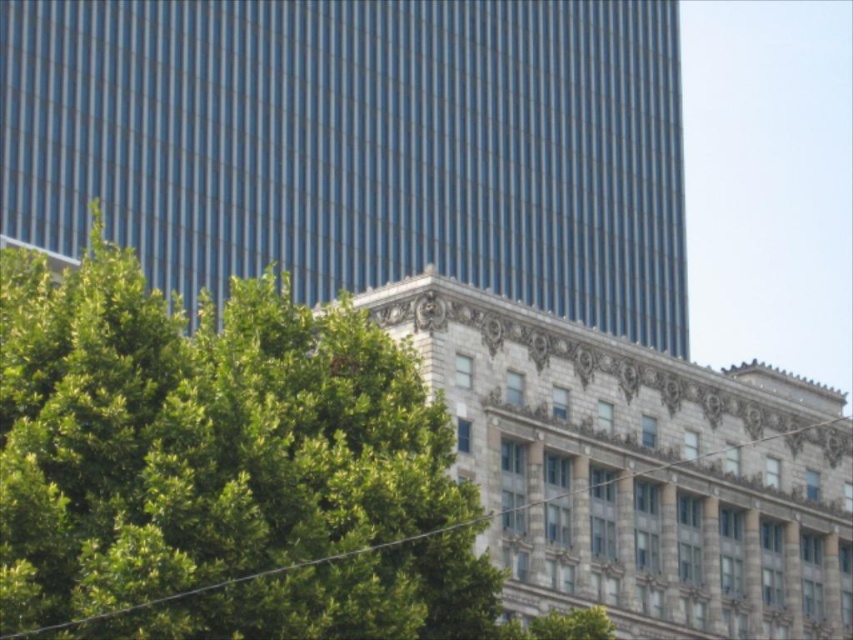
Question: Which of the following is the closest to the observer?

Choices:
 (A) glassy blue skyscraper at upper left
 (B) green leafy tree at lower left

Answer: (B)

Question: Among these objects, which one is nearest to the camera?

Choices:
 (A) green leafy tree at lower left
 (B) glassy blue skyscraper at upper left

Answer: (A)

Question: Can you confirm if glassy blue skyscraper at upper left is positioned to the right of green leafy tree at lower left?

Choices:
 (A) no
 (B) yes

Answer: (B)

Question: Is glassy blue skyscraper at upper left behind green leafy tree at lower left?

Choices:
 (A) no
 (B) yes

Answer: (B)

Question: Considering the relative positions of glassy blue skyscraper at upper left and green leafy tree at lower left in the image provided, where is glassy blue skyscraper at upper left located with respect to green leafy tree at lower left?

Choices:
 (A) right
 (B) left

Answer: (A)